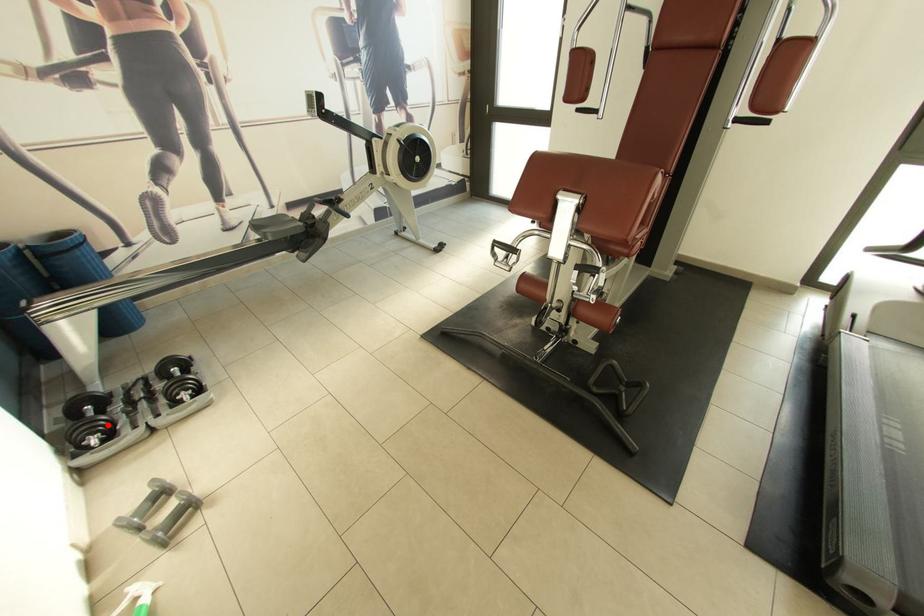
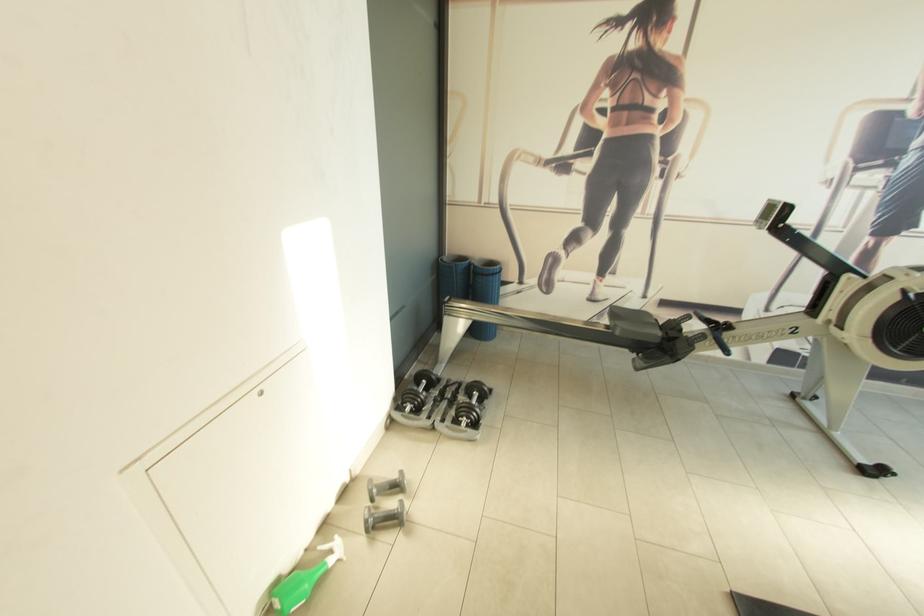
The point at the highlighted location is marked in the first image. Where is the corresponding point in the second image?

(424, 402)